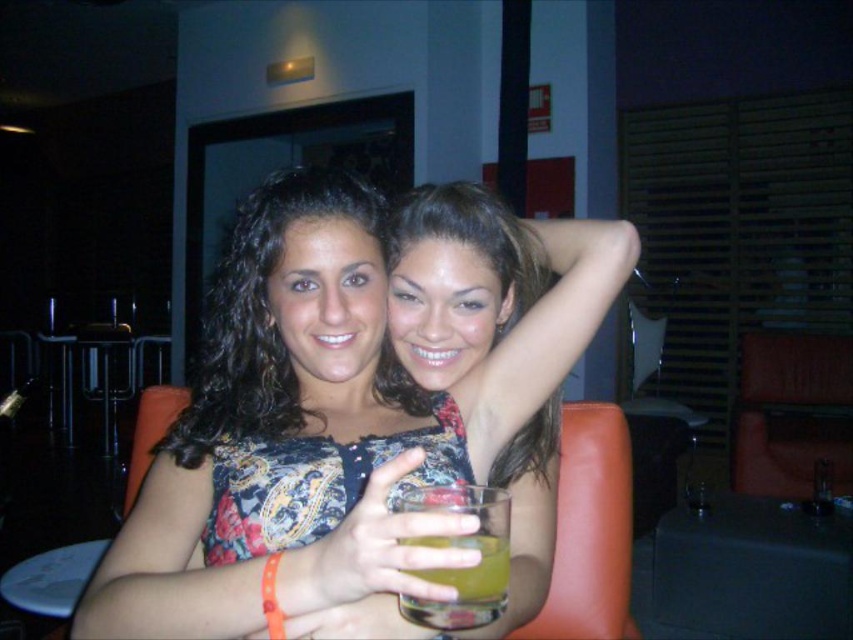
You are a bartender preparing to place a new drink on the table. The table has a leather at right and a translucent glass at center. Which surface can accommodate a larger drink container?

The leather at right has a larger size compared to the translucent glass at center, so it can accommodate a larger drink container.

You are a bartender who needs to place a new menu on the table. The menu is as wide as the translucent glass at center. Will it fit on the leather at right without overlapping the edge?

The leather at right is wider than the translucent glass at center, so the menu will fit without overlapping the edge.